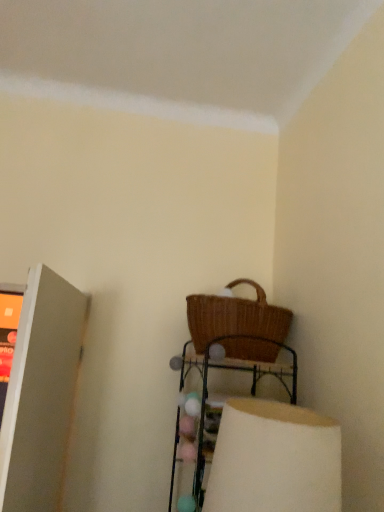
Question: Is woven wicker basket at upper center further to camera compared to white matte lampshade at lower right?

Choices:
 (A) yes
 (B) no

Answer: (A)

Question: From a real-world perspective, is woven wicker basket at upper center over white matte lampshade at lower right?

Choices:
 (A) yes
 (B) no

Answer: (B)

Question: Is woven wicker basket at upper center placed right next to white matte lampshade at lower right?

Choices:
 (A) yes
 (B) no

Answer: (B)

Question: Considering the relative sizes of woven wicker basket at upper center and white matte lampshade at lower right in the image provided, is woven wicker basket at upper center taller than white matte lampshade at lower right?

Choices:
 (A) no
 (B) yes

Answer: (B)

Question: Considering the relative sizes of woven wicker basket at upper center and white matte lampshade at lower right in the image provided, is woven wicker basket at upper center smaller than white matte lampshade at lower right?

Choices:
 (A) yes
 (B) no

Answer: (B)

Question: Is woven wicker basket at upper center positioned far away from white matte lampshade at lower right?

Choices:
 (A) no
 (B) yes

Answer: (A)

Question: Considering the relative positions of woven brown picnic basket at lower right and woven wicker basket at upper center in the image provided, is woven brown picnic basket at lower right to the right of woven wicker basket at upper center from the viewer's perspective?

Choices:
 (A) no
 (B) yes

Answer: (B)

Question: Does woven brown picnic basket at lower right have a greater width compared to woven wicker basket at upper center?

Choices:
 (A) no
 (B) yes

Answer: (B)

Question: Considering the relative sizes of woven brown picnic basket at lower right and woven wicker basket at upper center in the image provided, is woven brown picnic basket at lower right thinner than woven wicker basket at upper center?

Choices:
 (A) yes
 (B) no

Answer: (B)

Question: Is woven brown picnic basket at lower right with woven wicker basket at upper center?

Choices:
 (A) yes
 (B) no

Answer: (B)

Question: Is woven brown picnic basket at lower right completely or partially outside of woven wicker basket at upper center?

Choices:
 (A) yes
 (B) no

Answer: (A)

Question: From a real-world perspective, is woven brown picnic basket at lower right beneath woven wicker basket at upper center?

Choices:
 (A) no
 (B) yes

Answer: (A)

Question: Considering the relative sizes of white matte lampshade at lower right and matte gray shelf at left in the image provided, is white matte lampshade at lower right thinner than matte gray shelf at left?

Choices:
 (A) no
 (B) yes

Answer: (A)